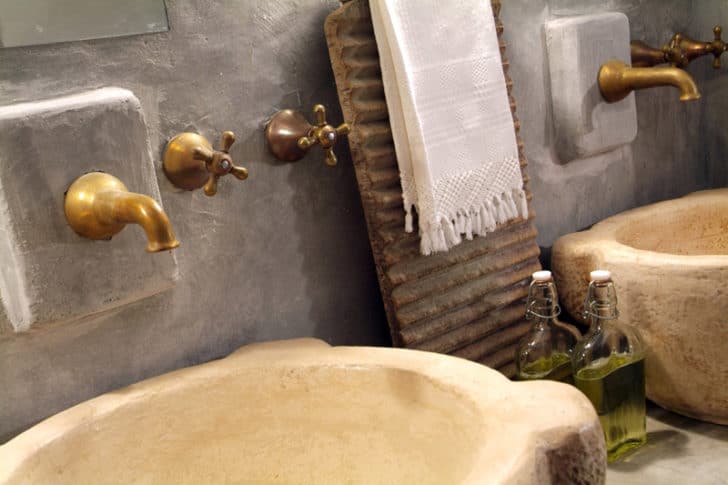
You are a GUI agent. You are given a task and a screenshot of the screen. Output one action in this format:
    pyautogui.click(x=<x>, y=<y>)
    Task: Click on the wall
    The image size is (728, 485).
    Given the screenshot: What is the action you would take?
    pyautogui.click(x=257, y=253)